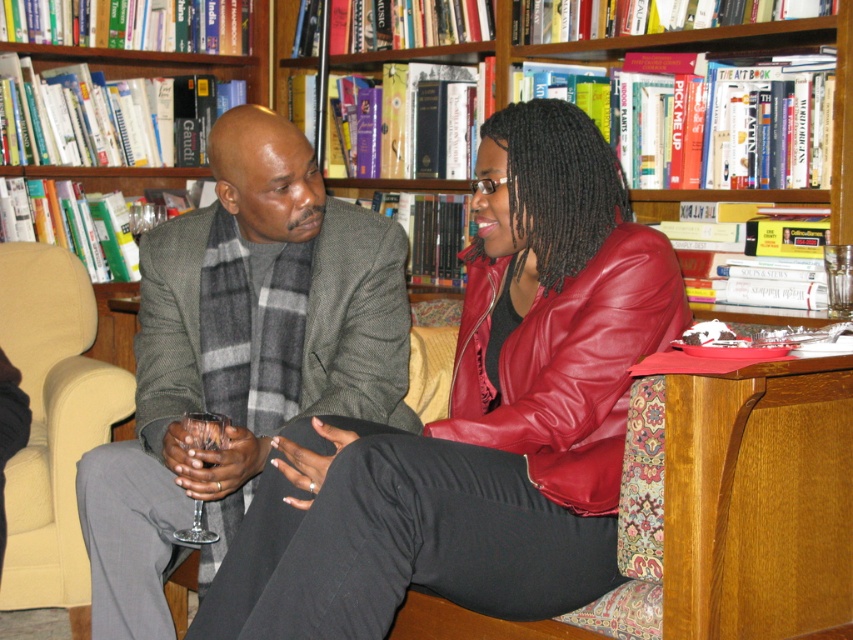
Question: Which of the following is the farthest from the observer?

Choices:
 (A) (567, 120)
 (B) (787, 36)
 (C) (9, 356)

Answer: (C)

Question: Is beige fabric armchair at left positioned at the back of transparent glass at lower left?

Choices:
 (A) yes
 (B) no

Answer: (A)

Question: Which of the following is the closest to the observer?

Choices:
 (A) (281, 467)
 (B) (373, 342)

Answer: (A)

Question: Does leather jacket at center have a greater width compared to wooden bookcase at upper center?

Choices:
 (A) yes
 (B) no

Answer: (B)

Question: Which object is the closest to the gray wool scarf at left?

Choices:
 (A) transparent glass at lower left
 (B) wooden bookcase at upper center

Answer: (A)

Question: Does gray wool scarf at left have a lesser width compared to wooden bookcase at upper center?

Choices:
 (A) no
 (B) yes

Answer: (B)